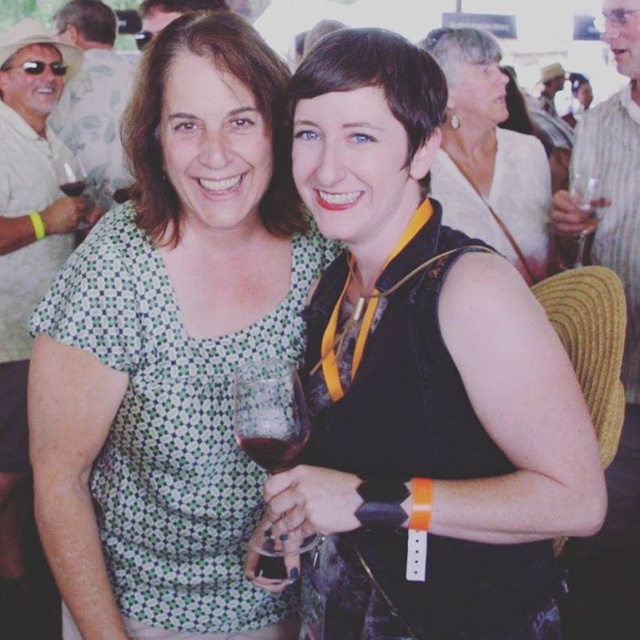
Question: Considering the relative positions of translucent glass at center and translucent glass at upper left in the image provided, where is translucent glass at center located with respect to translucent glass at upper left?

Choices:
 (A) left
 (B) right

Answer: (B)

Question: From the image, what is the correct spatial relationship of translucent glass at center in relation to matte glass at left?

Choices:
 (A) below
 (B) above

Answer: (A)

Question: Among these objects, which one is nearest to the camera?

Choices:
 (A) black matte vest at center
 (B) matte black vest at center

Answer: (B)

Question: Among these objects, which one is nearest to the camera?

Choices:
 (A) translucent glass at upper left
 (B) green dotted dress at center
 (C) clear glass wine glass at upper right

Answer: (B)

Question: Which point is farther to the camera?

Choices:
 (A) (324, 77)
 (B) (506, 81)

Answer: (B)

Question: Does green dotted dress at center appear on the left side of translucent glass at upper left?

Choices:
 (A) yes
 (B) no

Answer: (B)